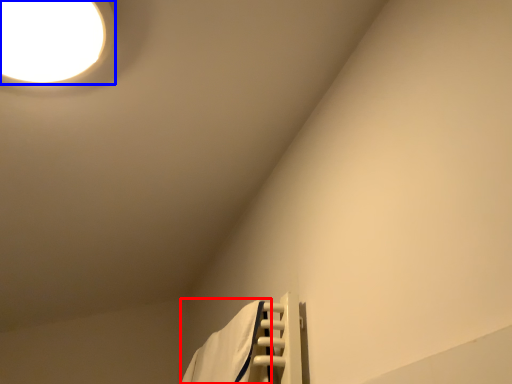
Question: Among these objects, which one is farthest to the camera, bath towel (highlighted by a red box) or lamp (highlighted by a blue box)?

Choices:
 (A) bath towel
 (B) lamp

Answer: (A)